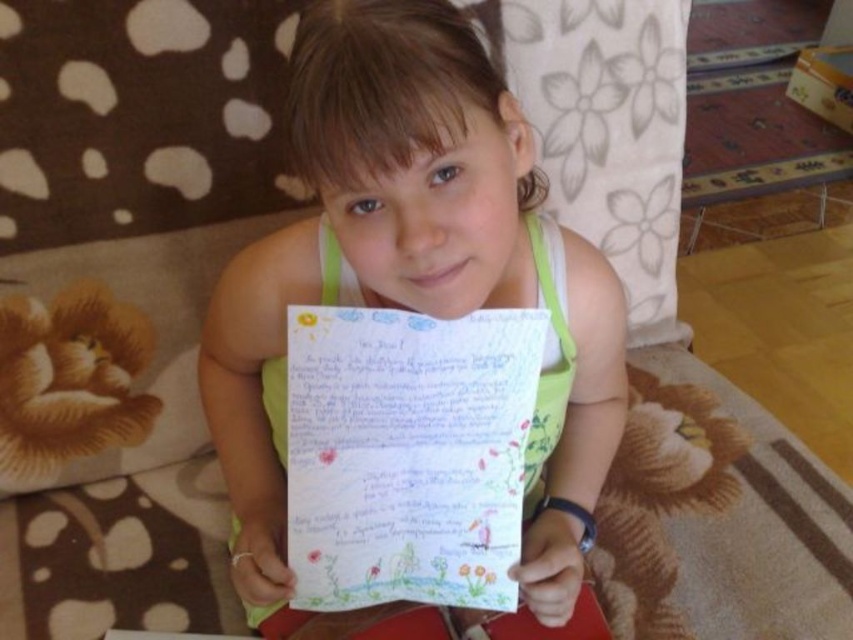
The girl is holding a colored paper at center while wearing a green fabric shirt at center. Which item is wider?

The green fabric shirt at center is wider than the colored paper at center.

The girl is holding a paper with drawings. Where is the green fabric shirt at center in relation to the paper she is holding?

The green fabric shirt at center is located at point (415, 275), which is slightly to the left and above the paper she is holding.